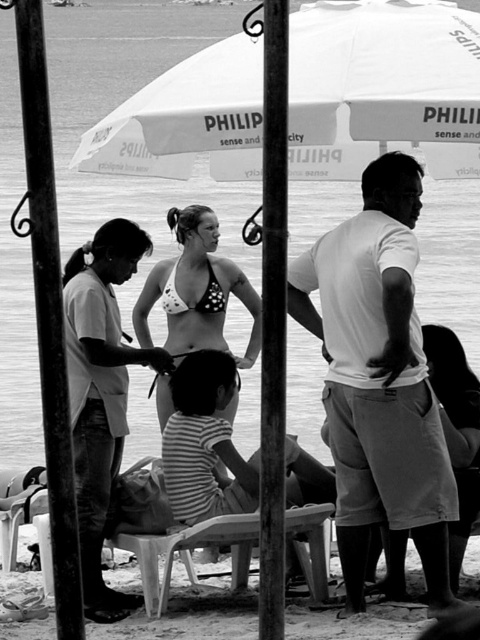
You are a photographer setting up equipment for an event. You need to place a large camera bag that requires 1.2 meters of space. Looking at the scene, can the space between the white fabric umbrella at upper center and the white cotton shirt at right accommodate your camera bag?

The white fabric umbrella at upper center is bigger than the white cotton shirt at right, but the exact distance between them isn not specified. Without knowing the actual spacing, it is uncertain if the camera bag will fit.

You are standing at the beach under the PHILIPS sense and city canopy. There is a point marked at coordinates (95, 515). If you want to place a 10 meter long banner from your current position to that point, will it be long enough to reach?

The point at (95, 515) is 11.79 meters away from the viewer. Since the banner is only 10 meters long, it will not be long enough to reach the point.

In the beach scene under the PHILIPS sense and city canopy, there is a woman wearing a matte white bikini at center and another woman wearing a polka dot bikini top at center. Which bikini is positioned lower on the woman?

The matte white bikini at center is below the polka dot bikini top at center, so the matte white bikini at center is positioned lower on the woman.